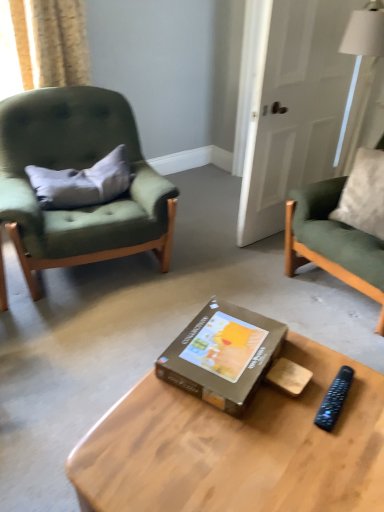
Question: From the image's perspective, is brown cardboard box at center located above or below white glossy door at upper right?

Choices:
 (A) below
 (B) above

Answer: (A)

Question: From a real-world perspective, is brown cardboard box at center positioned above or below white glossy door at upper right?

Choices:
 (A) above
 (B) below

Answer: (B)

Question: Which object is the closest to the velvet green armchair at right, the first chair viewed from the right?

Choices:
 (A) black plastic remote at lower right
 (B) brown cardboard box at center
 (C) wooden coffee table at center
 (D) light beige textured curtain at upper left
 (E) gray fabric pillow at left

Answer: (B)

Question: Which object is positioned farthest from the velvet green armchair at right, the first chair viewed from the right?

Choices:
 (A) brown cardboard box at center
 (B) green fabric chair at left, arranged as the second chair when viewed from the right
 (C) light beige textured curtain at upper left
 (D) black plastic remote at lower right
 (E) gray fabric pillow at left

Answer: (C)